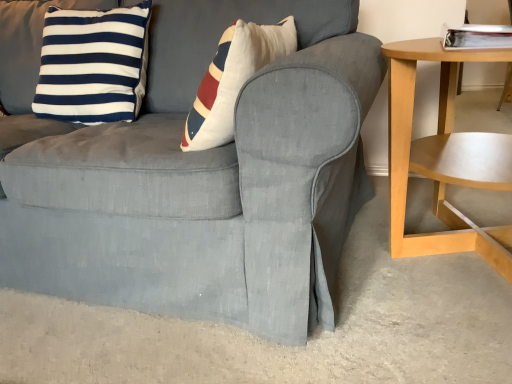
Question: Can you confirm if navy blue/white striped cushion at upper left is positioned to the right of light wood/woodenobject at right?

Choices:
 (A) yes
 (B) no

Answer: (B)

Question: Can light wood/woodenobject at right be found inside navy blue/white striped cushion at upper left?

Choices:
 (A) no
 (B) yes

Answer: (A)

Question: From the image's perspective, is navy blue/white striped cushion at upper left located beneath light wood/woodenobject at right?

Choices:
 (A) no
 (B) yes

Answer: (A)

Question: Is navy blue/white striped cushion at upper left behind light wood/woodenobject at right?

Choices:
 (A) yes
 (B) no

Answer: (A)

Question: Can you confirm if navy blue/white striped cushion at upper left is taller than light wood/woodenobject at right?

Choices:
 (A) yes
 (B) no

Answer: (B)

Question: Does point (169, 200) appear closer or farther from the camera than point (124, 104)?

Choices:
 (A) farther
 (B) closer

Answer: (B)

Question: Is matte gray slipcover at center wider or thinner than navy blue/white striped cushion at upper left?

Choices:
 (A) thin
 (B) wide

Answer: (B)

Question: Is matte gray slipcover at center bigger or smaller than navy blue/white striped cushion at upper left?

Choices:
 (A) big
 (B) small

Answer: (A)

Question: Considering their positions, is matte gray slipcover at center located in front of or behind navy blue/white striped cushion at upper left?

Choices:
 (A) front
 (B) behind

Answer: (A)

Question: Considering the positions of point (388, 56) and point (117, 79), is point (388, 56) closer or farther from the camera than point (117, 79)?

Choices:
 (A) farther
 (B) closer

Answer: (B)

Question: Which is correct: light wood/woodenobject at right is inside navy blue/white striped cushion at upper left, or outside of it?

Choices:
 (A) inside
 (B) outside

Answer: (B)

Question: Relative to navy blue/white striped cushion at upper left, is light wood/woodenobject at right in front or behind?

Choices:
 (A) front
 (B) behind

Answer: (A)

Question: In the image, is light wood/woodenobject at right on the left side or the right side of navy blue/white striped cushion at upper left?

Choices:
 (A) left
 (B) right

Answer: (B)

Question: Considering the positions of navy blue/white striped cushion at upper left and matte gray slipcover at center in the image, is navy blue/white striped cushion at upper left wider or thinner than matte gray slipcover at center?

Choices:
 (A) wide
 (B) thin

Answer: (B)

Question: From a real-world perspective, is navy blue/white striped cushion at upper left above or below matte gray slipcover at center?

Choices:
 (A) above
 (B) below

Answer: (A)